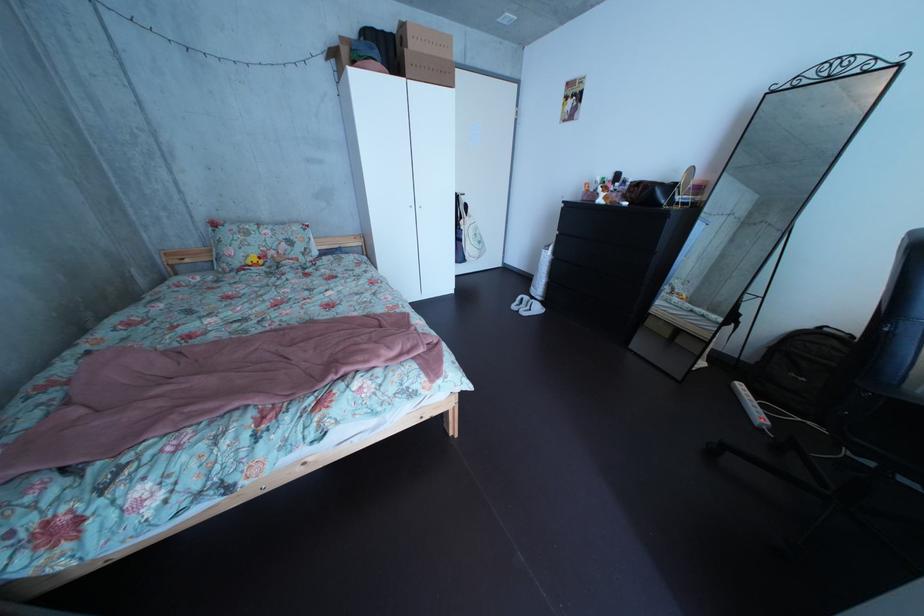
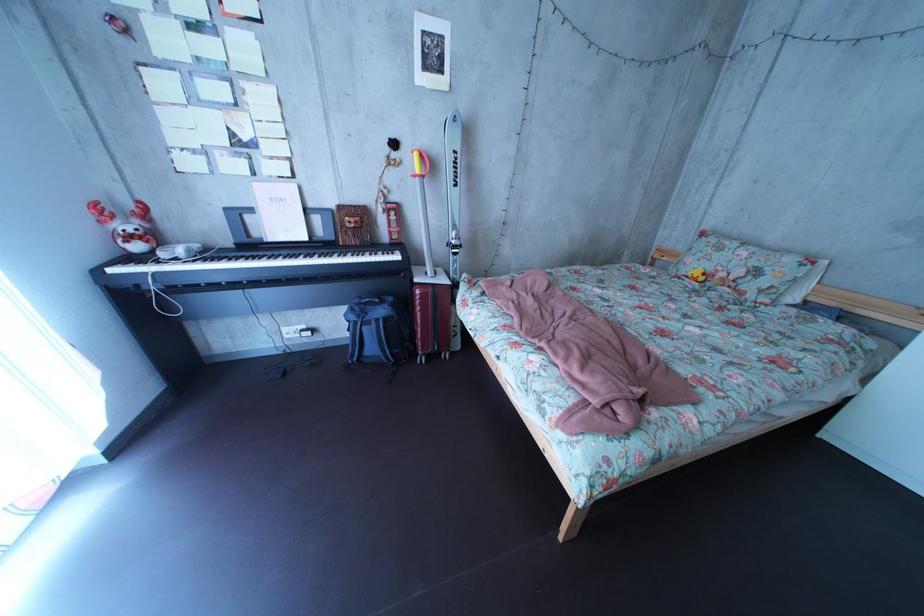
Locate, in the second image, the point that corresponds to point 263,246 in the first image.

(731, 262)